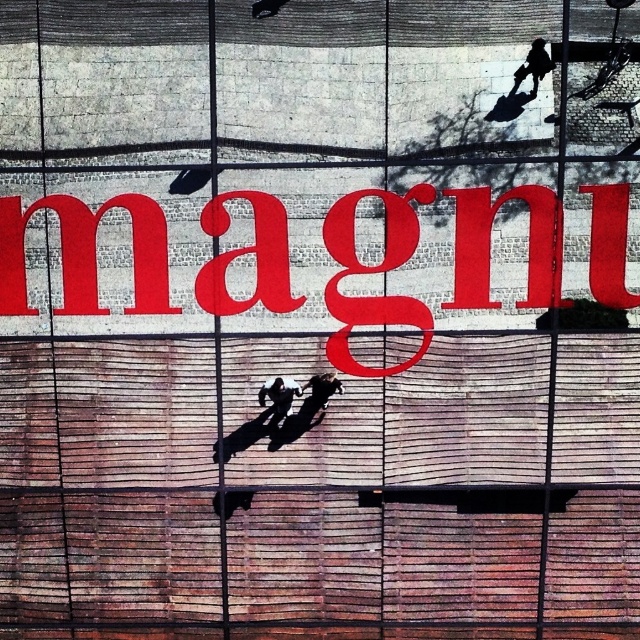
You are standing in front of the wall with the red letters. There is a point at coordinate (532, 67). What is located at that point?

The point at coordinate (532, 67) corresponds to the smooth black suit at upper right.

You are a delivery person who needs to place a new red matte sign at center. The current red matte sign is at point (84, 253). Is the new sign placed correctly?

The red matte sign at center is already located at point (84, 253), so the new sign is placed correctly there.